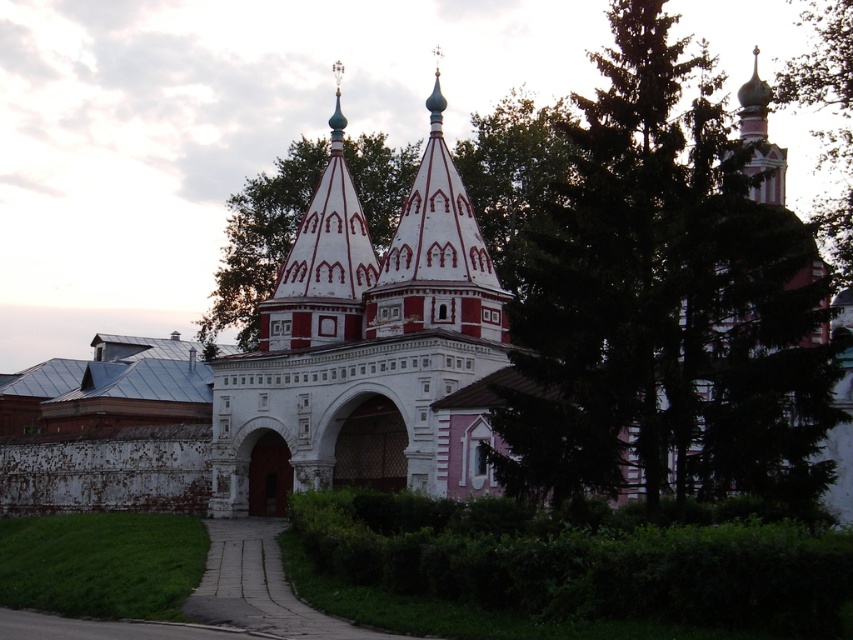
Is white stone church at center to the left of green leafy tree at upper right from the viewer's perspective?

Indeed, white stone church at center is positioned on the left side of green leafy tree at upper right.

Can you confirm if white stone church at center is taller than green leafy tree at upper right?

Indeed, white stone church at center has a greater height compared to green leafy tree at upper right.

Locate an element on the screen. The width and height of the screenshot is (853, 640). white stone church at center is located at coordinates (289, 369).

Image resolution: width=853 pixels, height=640 pixels. Describe the element at coordinates (669, 298) in the screenshot. I see `green textured tree at center` at that location.

Is point (793, 269) farther from camera compared to point (480, 262)?

No, (793, 269) is in front of (480, 262).

The width and height of the screenshot is (853, 640). I want to click on green textured tree at center, so click(x=669, y=298).

Locate an element on the screen. Image resolution: width=853 pixels, height=640 pixels. green textured tree at center is located at coordinates (669, 298).

The height and width of the screenshot is (640, 853). In order to click on white stone church at center in this screenshot , I will do `click(289, 369)`.

Looking at this image, which of these two, white stone church at center or red painted wood spire at center, stands taller?

Standing taller between the two is white stone church at center.

Which is behind, point (119, 509) or point (463, 320)?

Positioned behind is point (119, 509).

The image size is (853, 640). What are the coordinates of `white stone church at center` in the screenshot? It's located at (289, 369).